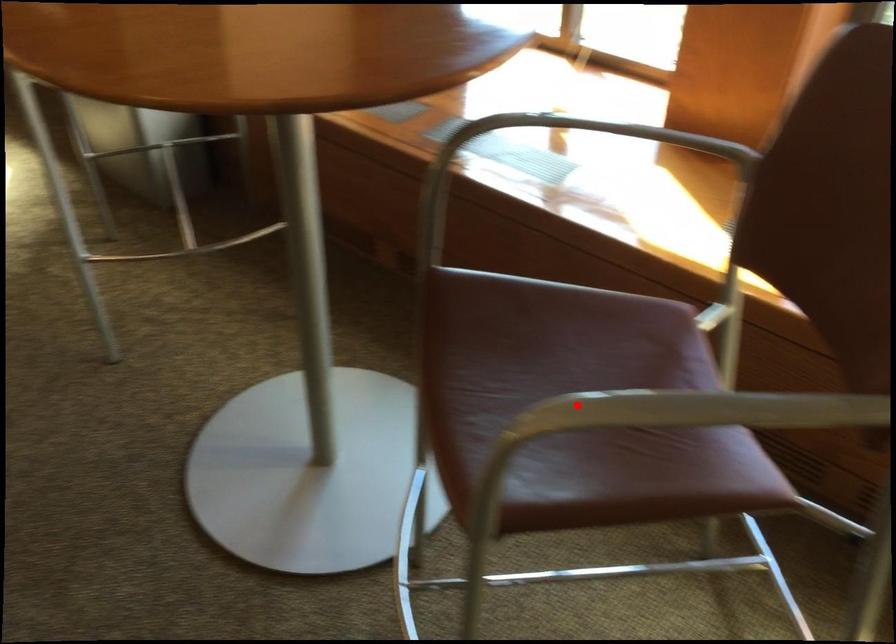
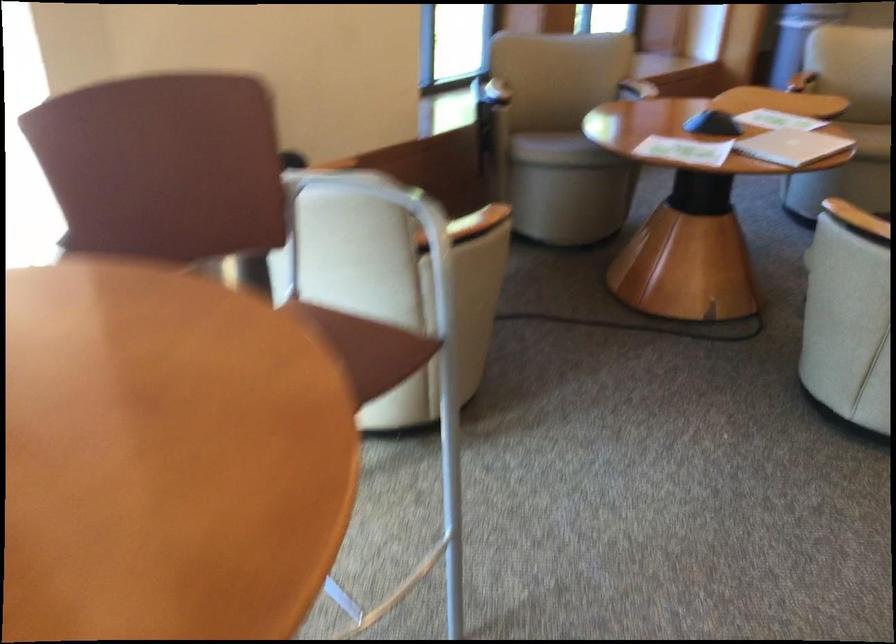
Question: I am providing you with two images of the same scene from different viewpoints. A red point is marked on the first image. Can you still see the location of the red point in image 2?

Choices:
 (A) Yes
 (B) No

Answer: (B)